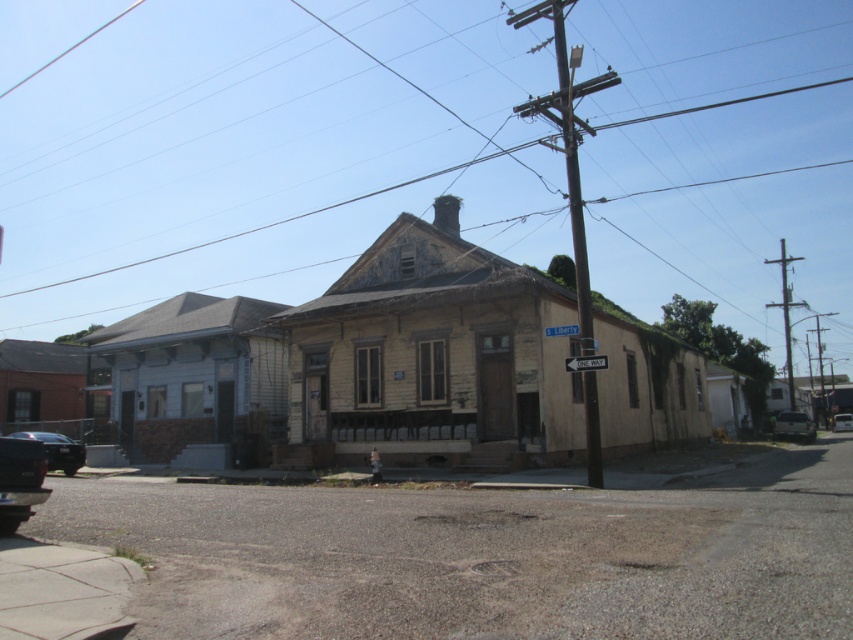
Question: Can you confirm if metallic silver car at lower right is smaller than wooden utility pole at right?

Choices:
 (A) yes
 (B) no

Answer: (A)

Question: Which object is the closest to the metallic gray utility pole at right?

Choices:
 (A) wooden utility pole at right
 (B) shiny black car at lower left
 (C) metallic silver car at lower right
 (D) shiny black sedan at lower left

Answer: (A)

Question: Which of the following is the closest to the observer?

Choices:
 (A) (x=817, y=326)
 (B) (x=784, y=419)
 (C) (x=566, y=164)

Answer: (B)

Question: Does wooden utility pole at center have a smaller size compared to shiny black sedan at lower left?

Choices:
 (A) no
 (B) yes

Answer: (A)

Question: Which point is closer to the camera?

Choices:
 (A) metallic silver van at center
 (B) metallic gray utility pole at right
 (C) shiny black sedan at lower left
 (D) wooden utility pole at center

Answer: (D)

Question: From the image, what is the correct spatial relationship of wooden utility pole at center in relation to shiny black car at lower left?

Choices:
 (A) below
 (B) above

Answer: (B)